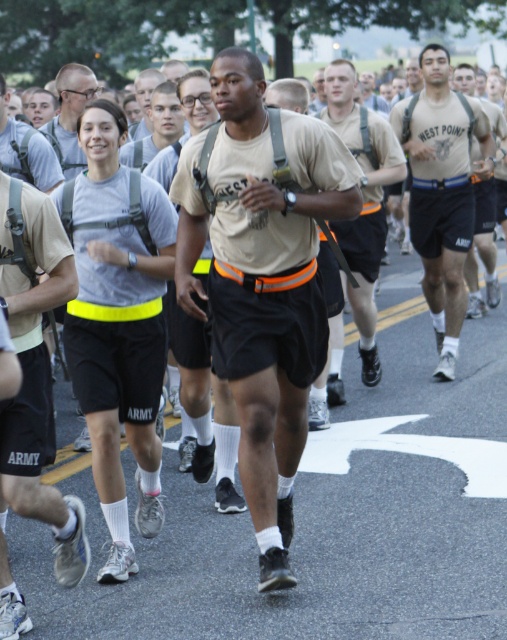
Looking at this image, is tan matte uniform at center closer to the viewer compared to tan uniform shirt at center?

Yes, it is in front of tan uniform shirt at center.

Who is more distant from viewer, (x=321, y=216) or (x=445, y=70)?

The point (x=445, y=70) is behind.

This screenshot has height=640, width=507. What do you see at coordinates (262, 280) in the screenshot? I see `tan matte uniform at center` at bounding box center [262, 280].

Identify the location of tan matte uniform at center. The image size is (507, 640). (262, 280).

Between tan matte uniform at center and matte gray shirt at upper center, which one appears on the right side from the viewer's perspective?

From the viewer's perspective, tan matte uniform at center appears more on the right side.

At what (x,y) coordinates should I click in order to perform the action: click on tan matte uniform at center. Please return your answer as a coordinate pair (x, y). The width and height of the screenshot is (507, 640). Looking at the image, I should click on (262, 280).

Can you confirm if tan uniform shirt at center is bigger than tan uniform at center?

Correct, tan uniform shirt at center is larger in size than tan uniform at center.

What are the coordinates of `tan uniform shirt at center` in the screenshot? It's located at (443, 192).

Locate an element on the screen. The height and width of the screenshot is (640, 507). tan uniform shirt at center is located at coordinates (443, 192).

Locate an element on the screen. tan uniform shirt at center is located at coordinates (443, 192).